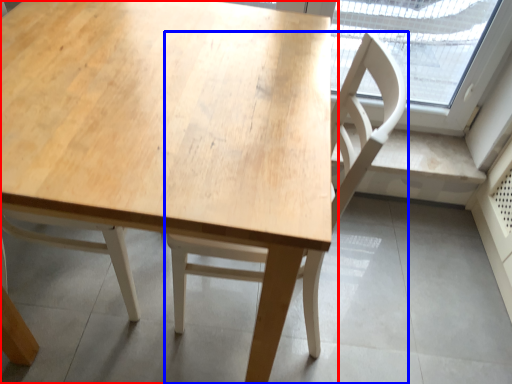
Question: Which object appears closest to the camera in this image, table (highlighted by a red box) or chair (highlighted by a blue box)?

Choices:
 (A) table
 (B) chair

Answer: (A)